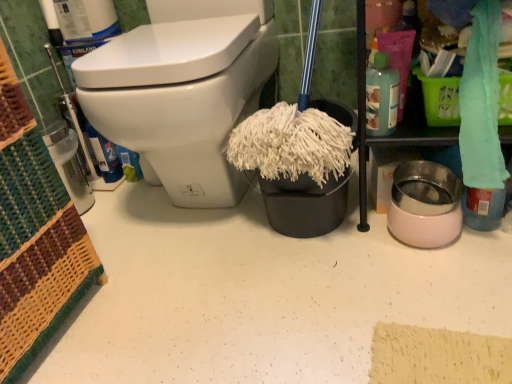
Question: Is translucent plastic bottle at upper right shorter than teal fabric towel at upper right?

Choices:
 (A) yes
 (B) no

Answer: (A)

Question: Does translucent plastic bottle at upper right contain teal fabric towel at upper right?

Choices:
 (A) no
 (B) yes

Answer: (A)

Question: Considering the relative sizes of translucent plastic bottle at upper right and teal fabric towel at upper right in the image provided, is translucent plastic bottle at upper right smaller than teal fabric towel at upper right?

Choices:
 (A) yes
 (B) no

Answer: (A)

Question: Is translucent plastic bottle at upper right to the right of teal fabric towel at upper right from the viewer's perspective?

Choices:
 (A) no
 (B) yes

Answer: (A)

Question: From a real-world perspective, does translucent plastic bottle at upper right sit lower than teal fabric towel at upper right?

Choices:
 (A) yes
 (B) no

Answer: (B)

Question: Is translucent plastic bottle at upper right oriented away from teal fabric towel at upper right?

Choices:
 (A) yes
 (B) no

Answer: (B)

Question: Can you confirm if translucent plastic bottle at upper right is wider than white glossy toilet at upper left?

Choices:
 (A) yes
 (B) no

Answer: (B)

Question: From a real-world perspective, is translucent plastic bottle at upper right positioned over white glossy toilet at upper left based on gravity?

Choices:
 (A) yes
 (B) no

Answer: (A)

Question: Can you confirm if translucent plastic bottle at upper right is positioned to the left of white glossy toilet at upper left?

Choices:
 (A) yes
 (B) no

Answer: (B)

Question: Is translucent plastic bottle at upper right aimed at white glossy toilet at upper left?

Choices:
 (A) yes
 (B) no

Answer: (B)

Question: Considering the relative sizes of translucent plastic bottle at upper right and white glossy toilet at upper left in the image provided, is translucent plastic bottle at upper right shorter than white glossy toilet at upper left?

Choices:
 (A) yes
 (B) no

Answer: (A)

Question: From the image's perspective, is translucent plastic bottle at upper right under white glossy toilet at upper left?

Choices:
 (A) yes
 (B) no

Answer: (A)

Question: Is teal fabric towel at upper right taller than translucent plastic bottle at upper right?

Choices:
 (A) no
 (B) yes

Answer: (B)